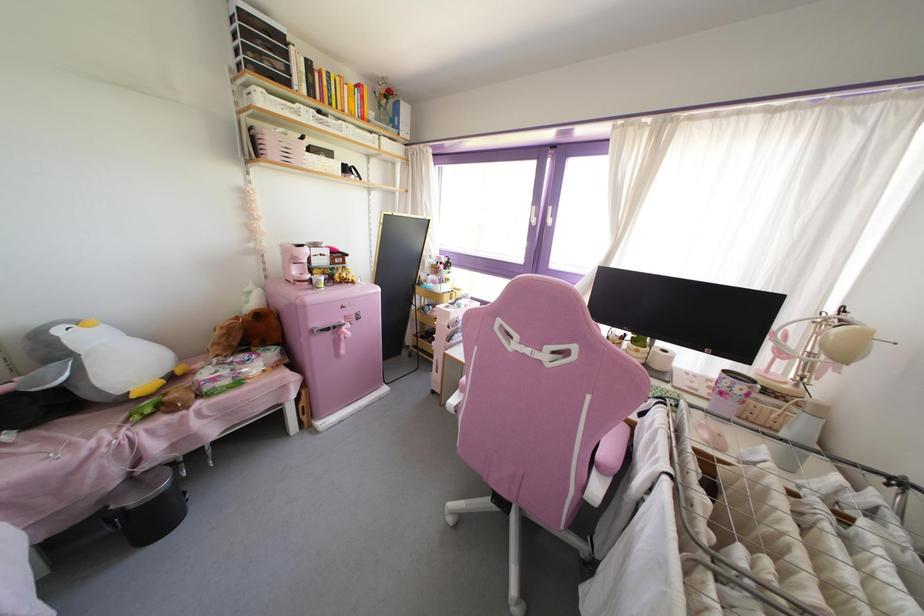
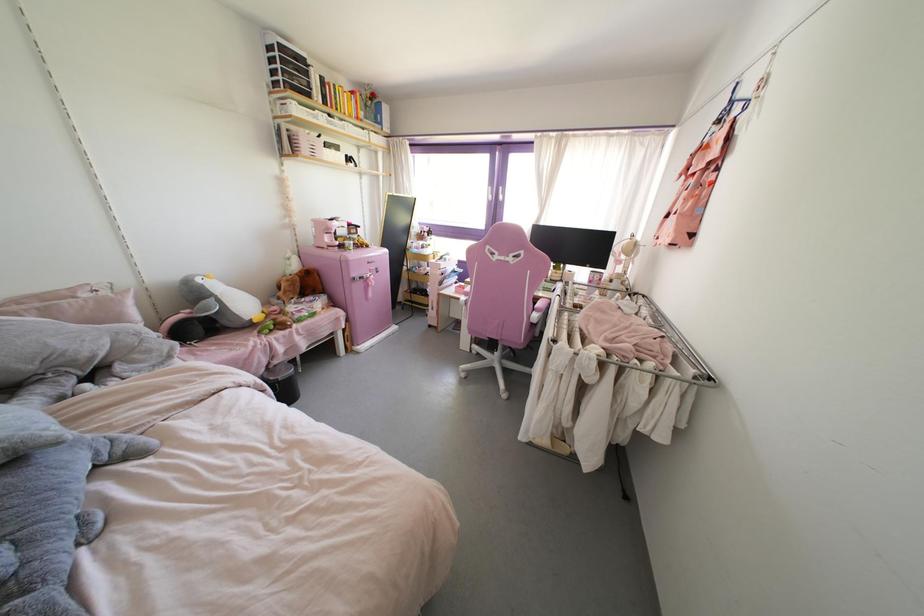
Locate, in the second image, the point that corresponds to pixel 322 158 in the first image.

(333, 151)